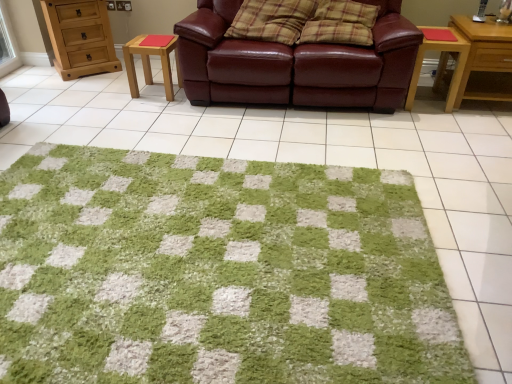
Find the location of a particular element. The width and height of the screenshot is (512, 384). free space in front of wooden stool at center-left, the first table positioned from the left is located at coordinates (151, 104).